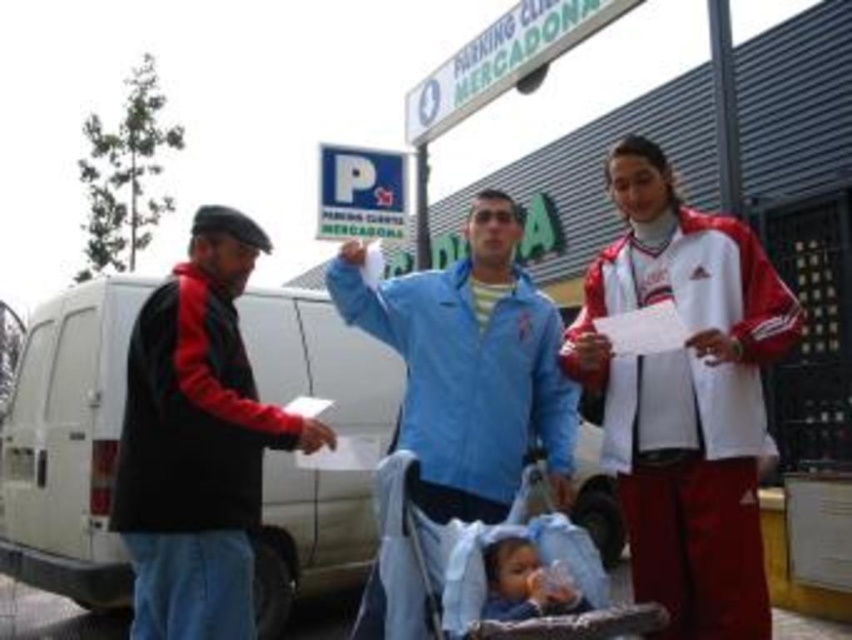
Between black fleece jacket at left and blue fabric baby carriage at center, which one has more height?

black fleece jacket at left is taller.

Measure the distance between point (213, 634) and camera.

The distance of point (213, 634) from camera is 10.18 feet.

Find the location of a particular element. The image size is (852, 640). black fleece jacket at left is located at coordinates (197, 442).

Is point (332, 506) behind point (521, 618)?

Yes, point (332, 506) is behind point (521, 618).

Who is taller, white matte van at left or soft blue fabric at center?

With more height is white matte van at left.

The image size is (852, 640). I want to click on white matte van at left, so click(x=68, y=444).

Which is above, white matte van at left or blue fabric baby carriage at center?

white matte van at left

Is point (300, 516) farther from viewer compared to point (378, 618)?

That is True.

Is point (341, 573) positioned after point (380, 625)?

Yes, point (341, 573) is behind point (380, 625).

Where is `white matte van at left`? The image size is (852, 640). white matte van at left is located at coordinates (68, 444).